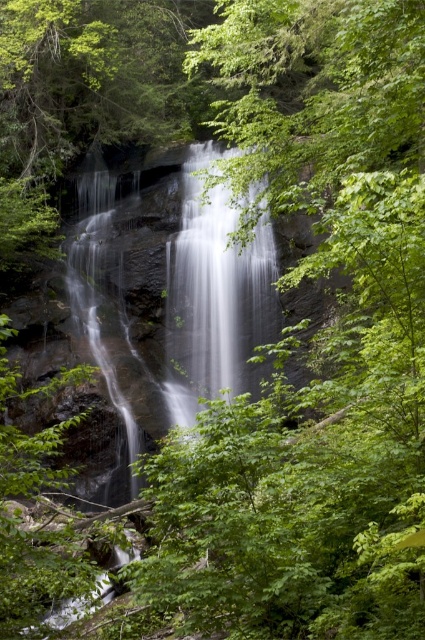
Who is taller, smooth gray rock waterfall at center or white smooth waterfall at center?

smooth gray rock waterfall at center

Measure the distance between point (187, 424) and camera.

Point (187, 424) and camera are 20.40 meters apart.

The height and width of the screenshot is (640, 425). Describe the element at coordinates (172, 298) in the screenshot. I see `smooth gray rock waterfall at center` at that location.

The width and height of the screenshot is (425, 640). What are the coordinates of `smooth gray rock waterfall at center` in the screenshot? It's located at (172, 298).